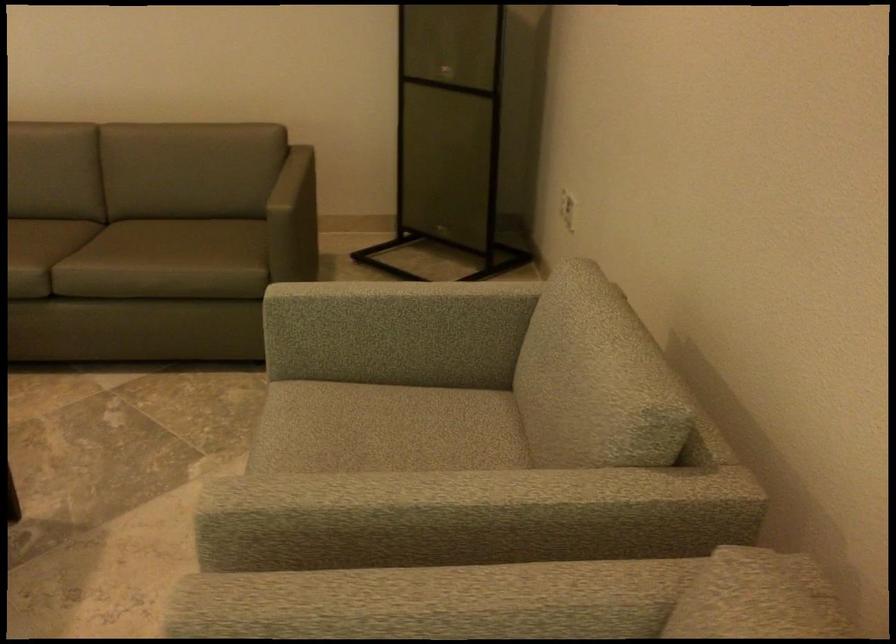
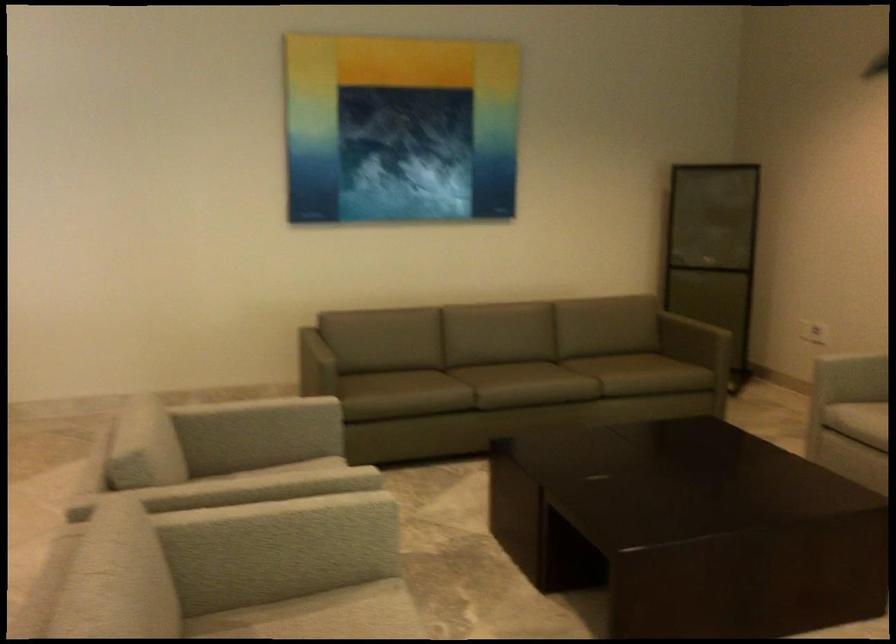
Where in the second image is the point corresponding to the point at 455,180 from the first image?

(713, 317)